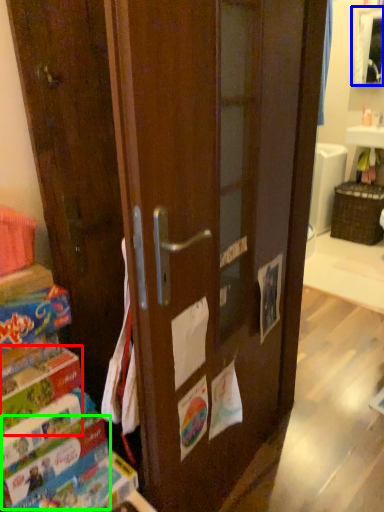
Question: Which object is the farthest from paperback book (highlighted by a red box)? Choose among these: cabinetry (highlighted by a blue box) or paperback book (highlighted by a green box).

Choices:
 (A) cabinetry
 (B) paperback book

Answer: (A)